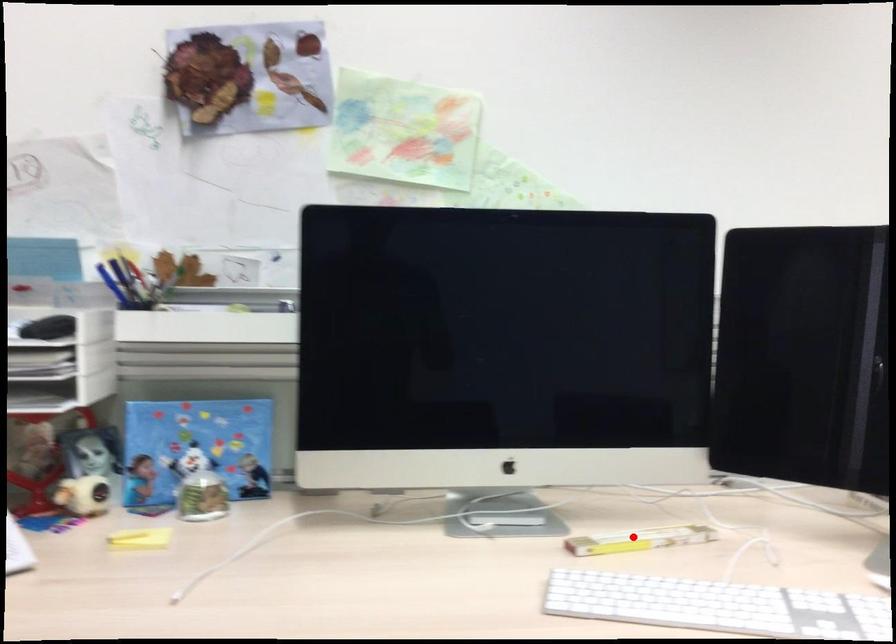
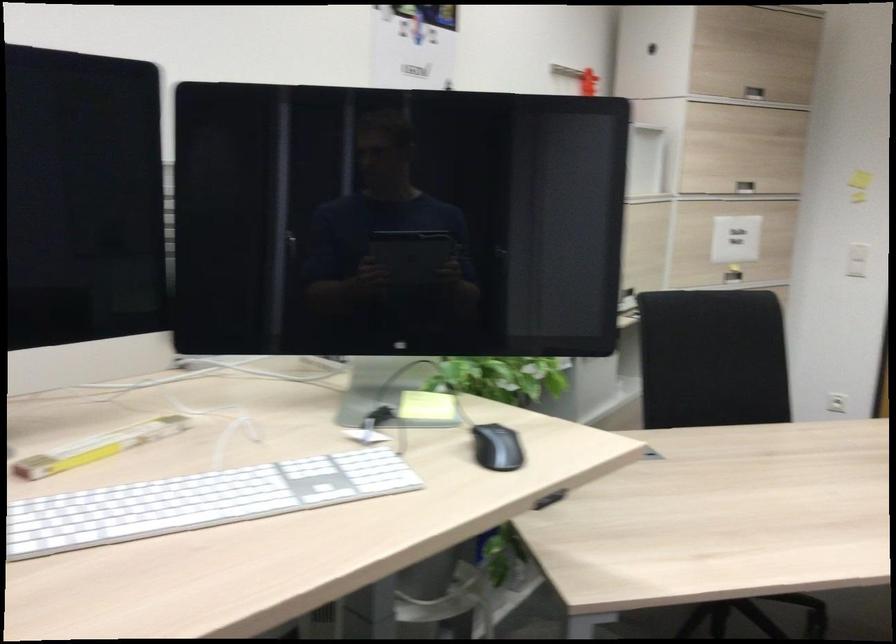
Question: I am providing you with two images of the same scene from different viewpoints. A red point is shown in image1. For the corresponding object point in image2, is it positioned nearer or farther from the camera?

Choices:
 (A) Nearer
 (B) Farther

Answer: (A)